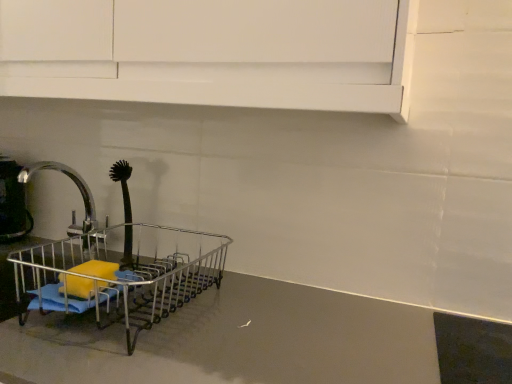
Locate an element on the screen. free spot to the right of metallic silver dish rack at left is located at coordinates (270, 330).